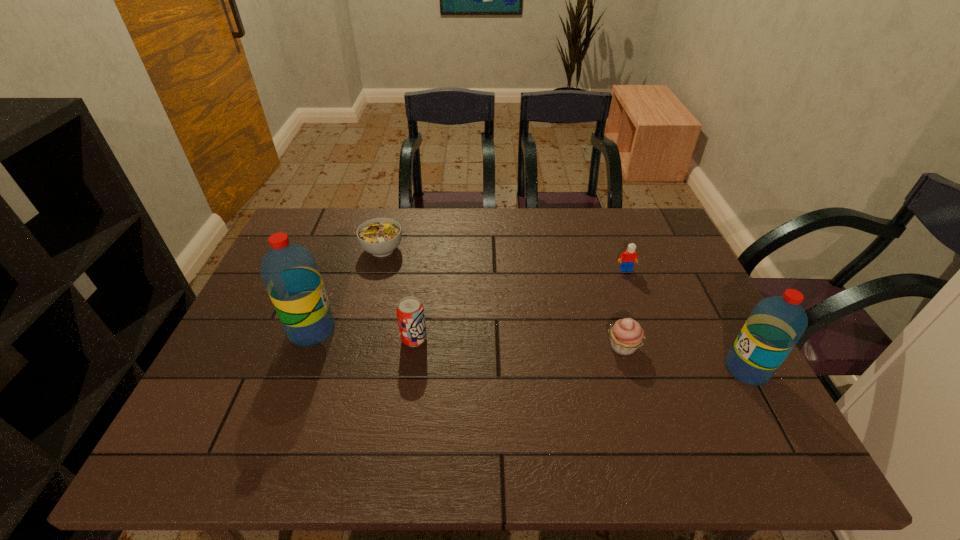
Locate an element on the screen. The height and width of the screenshot is (540, 960). empty space that is in between the second farthest object and the rightmost object is located at coordinates (686, 320).

Locate an element on the screen. unoccupied position between the nearer water bottle and the fourth shortest object is located at coordinates (581, 354).

Where is `free area in between the soup bowl and the taller water bottle`? The height and width of the screenshot is (540, 960). free area in between the soup bowl and the taller water bottle is located at coordinates (348, 290).

This screenshot has height=540, width=960. In order to click on free area in between the cupcake and the farthest object in this screenshot , I will do (x=502, y=298).

The height and width of the screenshot is (540, 960). I want to click on vacant point located between the left water bottle and the cupcake, so click(x=468, y=339).

At what (x,y) coordinates should I click in order to perform the action: click on empty space that is in between the fourth shortest object and the tallest object. Please return your answer as a coordinate pair (x, y). Looking at the image, I should click on coord(363,335).

Where is `empty location between the fifth object from left to right and the soda can`? This screenshot has width=960, height=540. empty location between the fifth object from left to right and the soda can is located at coordinates (520, 305).

At what (x,y) coordinates should I click in order to perform the action: click on free spot between the left water bottle and the farthest object. Please return your answer as a coordinate pair (x, y). The width and height of the screenshot is (960, 540). Looking at the image, I should click on (348, 290).

This screenshot has height=540, width=960. Find the location of `free space between the fourth object from left to right and the fifth shortest object`. free space between the fourth object from left to right and the fifth shortest object is located at coordinates (684, 358).

The image size is (960, 540). I want to click on free space between the second object from right to left and the third object from right to left, so click(624, 308).